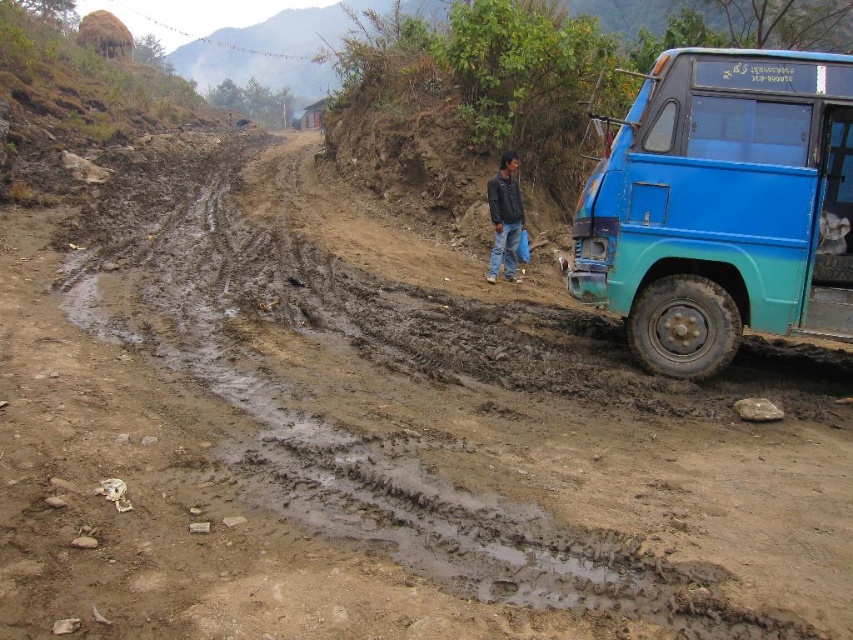
Between blue matte truck at right and black leather jacket at center, which one is positioned higher?

black leather jacket at center is above.

Can you confirm if blue matte truck at right is shorter than black leather jacket at center?

No, blue matte truck at right is not shorter than black leather jacket at center.

Does point (676, 74) come behind point (503, 180)?

No, it is in front of (503, 180).

Locate an element on the screen. Image resolution: width=853 pixels, height=640 pixels. blue matte truck at right is located at coordinates (722, 205).